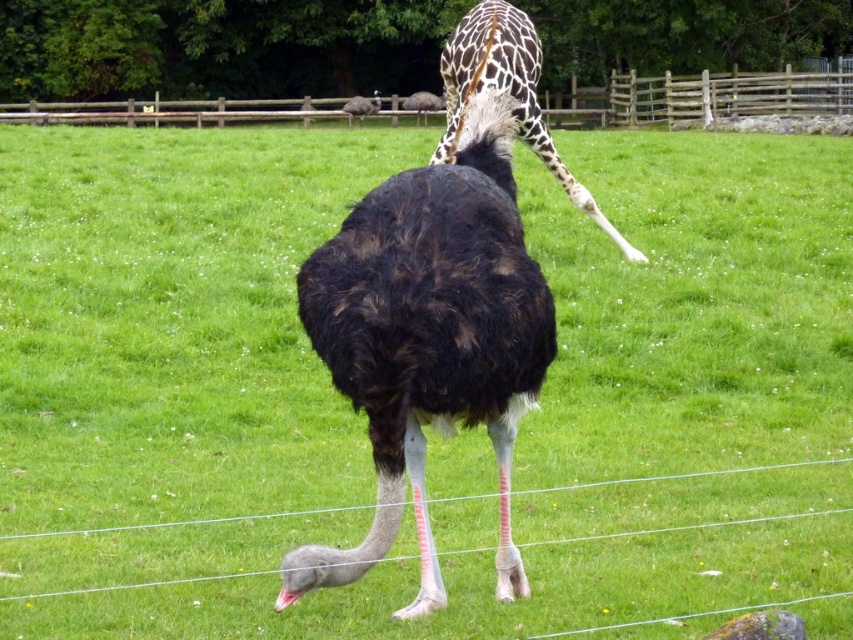
Question: Where is wooden fence at upper center located in relation to glossy spotted giraffe at upper center in the image?

Choices:
 (A) below
 (B) above

Answer: (B)

Question: Among these objects, which one is farthest from the camera?

Choices:
 (A) glossy spotted giraffe at upper center
 (B) wooden fence at upper center

Answer: (B)

Question: Can you confirm if dark brown feathers at center is bigger than glossy spotted giraffe at upper center?

Choices:
 (A) yes
 (B) no

Answer: (B)

Question: Which point is farther to the camera?

Choices:
 (A) glossy spotted giraffe at upper center
 (B) wooden fence at upper center

Answer: (B)

Question: Which object is the farthest from the wooden fence at upper center?

Choices:
 (A) dark brown feathers at center
 (B) glossy spotted giraffe at upper center

Answer: (A)

Question: Is dark brown feathers at center to the right of glossy spotted giraffe at upper center from the viewer's perspective?

Choices:
 (A) no
 (B) yes

Answer: (A)